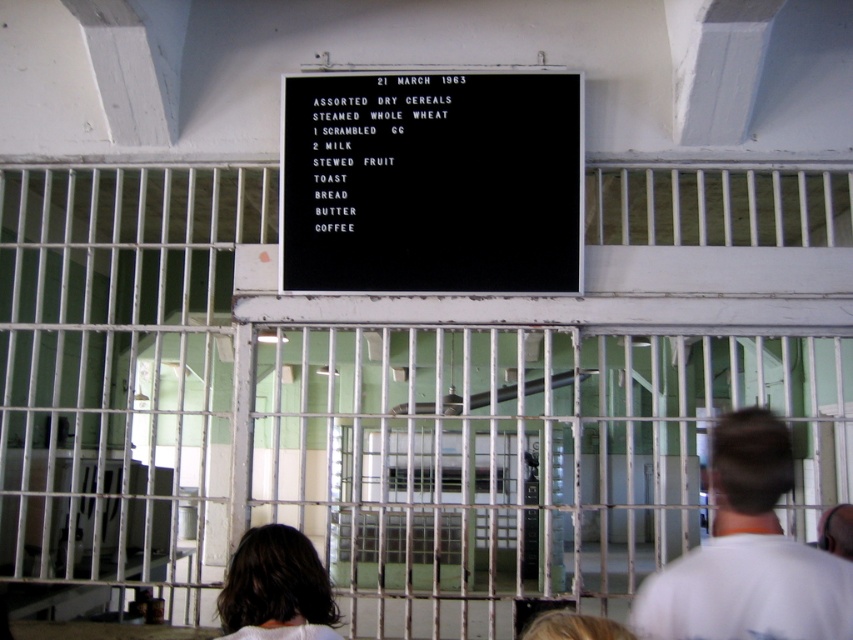
Does black plastic signboard at center have a greater height compared to dark brown hair at lower left?

Correct, black plastic signboard at center is much taller as dark brown hair at lower left.

Does black plastic signboard at center appear under dark brown hair at lower left?

Actually, black plastic signboard at center is above dark brown hair at lower left.

Does point (430, 237) lie in front of point (277, 630)?

No, (430, 237) is behind (277, 630).

Find the location of `black plastic signboard at center`. black plastic signboard at center is located at coordinates (431, 182).

Between black paper menu at center and dark brown hair at lower left, which one is positioned lower?

dark brown hair at lower left is below.

Is black paper menu at center positioned in front of dark brown hair at lower left?

That is False.

Find the location of a particular element. Image resolution: width=853 pixels, height=640 pixels. black paper menu at center is located at coordinates (370, 147).

What are the coordinates of `black paper menu at center` in the screenshot? It's located at (370, 147).

Between white metal bars at center and dark brown hair at lower left, which one has more height?

white metal bars at center is taller.

I want to click on white metal bars at center, so click(345, 422).

Measure the distance between point [78,464] and camera.

The distance of point [78,464] from camera is 16.88 feet.

This screenshot has width=853, height=640. Find the location of `white metal bars at center`. white metal bars at center is located at coordinates (345, 422).